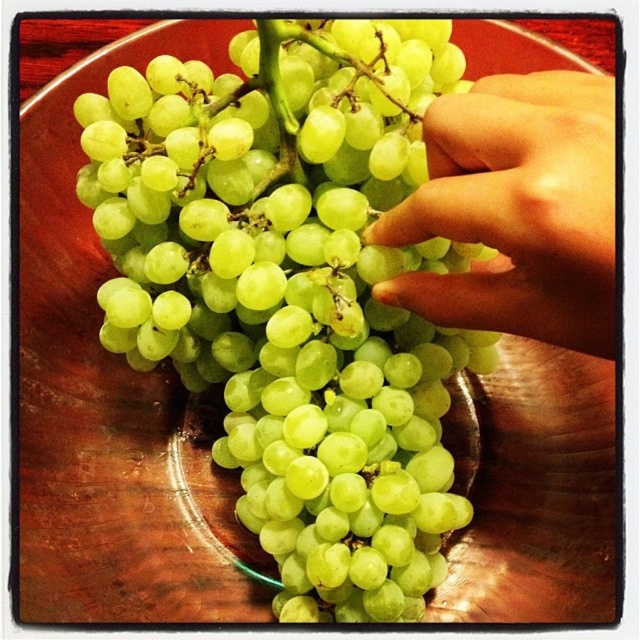
Does green matte grapes at center have a lesser width compared to smooth skin hand at upper right?

Incorrect, green matte grapes at center's width is not less than smooth skin hand at upper right's.

Can you confirm if green matte grapes at center is positioned to the right of smooth skin hand at upper right?

No, green matte grapes at center is not to the right of smooth skin hand at upper right.

Image resolution: width=640 pixels, height=640 pixels. Describe the element at coordinates (292, 289) in the screenshot. I see `green matte grapes at center` at that location.

Where is `green matte grapes at center`? This screenshot has height=640, width=640. green matte grapes at center is located at coordinates (292, 289).